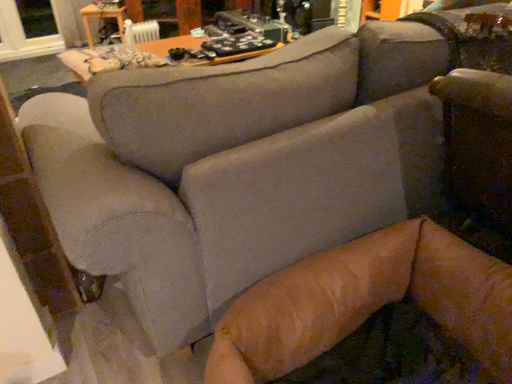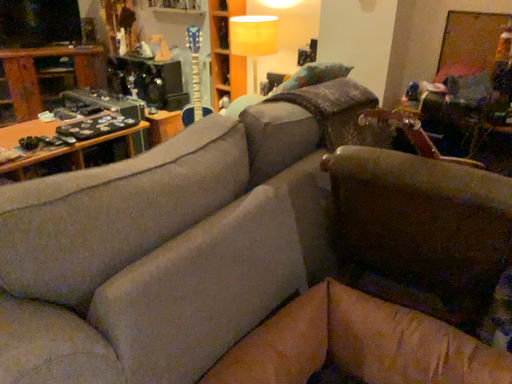
Question: How did the camera likely rotate when shooting the video?

Choices:
 (A) rotated left
 (B) rotated right

Answer: (B)